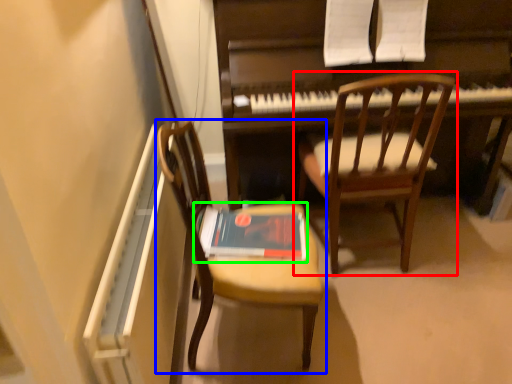
Question: Which object is the closest to the chair (highlighted by a red box)? Choose among these: chair (highlighted by a blue box) or paperback book (highlighted by a green box).

Choices:
 (A) chair
 (B) paperback book

Answer: (B)